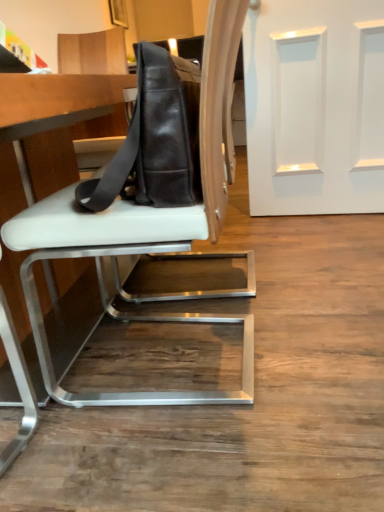
Question: Considering the relative sizes of white smooth door at upper right and black leather messenger bag at center in the image provided, is white smooth door at upper right shorter than black leather messenger bag at center?

Choices:
 (A) yes
 (B) no

Answer: (B)

Question: Is white smooth door at upper right located outside black leather messenger bag at center?

Choices:
 (A) yes
 (B) no

Answer: (A)

Question: Is white smooth door at upper right taller than black leather messenger bag at center?

Choices:
 (A) yes
 (B) no

Answer: (A)

Question: Are white smooth door at upper right and black leather messenger bag at center far apart?

Choices:
 (A) yes
 (B) no

Answer: (A)

Question: Is the position of white smooth door at upper right less distant than that of black leather messenger bag at center?

Choices:
 (A) yes
 (B) no

Answer: (B)

Question: Is white leather chair at center spatially inside black leather messenger bag at center, or outside of it?

Choices:
 (A) outside
 (B) inside

Answer: (A)

Question: From the image's perspective, is white leather chair at center positioned above or below black leather messenger bag at center?

Choices:
 (A) below
 (B) above

Answer: (A)

Question: Is white leather chair at center taller or shorter than black leather messenger bag at center?

Choices:
 (A) tall
 (B) short

Answer: (A)

Question: In terms of size, does white leather chair at center appear bigger or smaller than black leather messenger bag at center?

Choices:
 (A) big
 (B) small

Answer: (A)

Question: Is white smooth door at upper right to the left or to the right of white leather chair at center in the image?

Choices:
 (A) right
 (B) left

Answer: (A)

Question: Based on their sizes in the image, would you say white smooth door at upper right is bigger or smaller than white leather chair at center?

Choices:
 (A) big
 (B) small

Answer: (B)

Question: Is white smooth door at upper right taller or shorter than white leather chair at center?

Choices:
 (A) short
 (B) tall

Answer: (B)

Question: Is point (253, 37) positioned closer to the camera than point (64, 199)?

Choices:
 (A) closer
 (B) farther

Answer: (B)

Question: Considering the positions of point (28, 179) and point (198, 226), is point (28, 179) closer or farther from the camera than point (198, 226)?

Choices:
 (A) farther
 (B) closer

Answer: (A)

Question: From a real-world perspective, relative to white leather chair at center, is white leather table at center vertically above or below?

Choices:
 (A) below
 (B) above

Answer: (A)